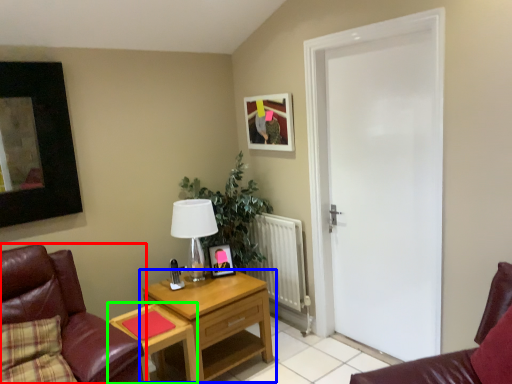
Question: Which is nearer to the chair (highlighted by a red box)? nightstand (highlighted by a blue box) or desk (highlighted by a green box).

Choices:
 (A) nightstand
 (B) desk

Answer: (B)